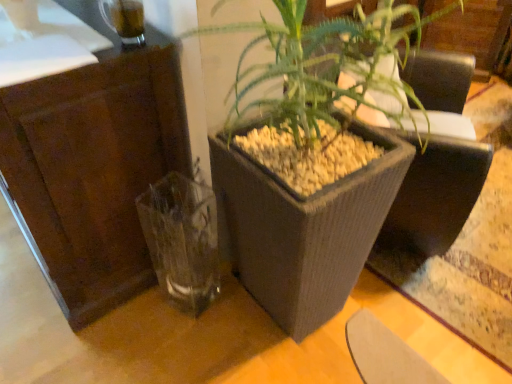
Locate an element on the screen. free point to the right of transparent glass vase at lower left is located at coordinates (236, 311).